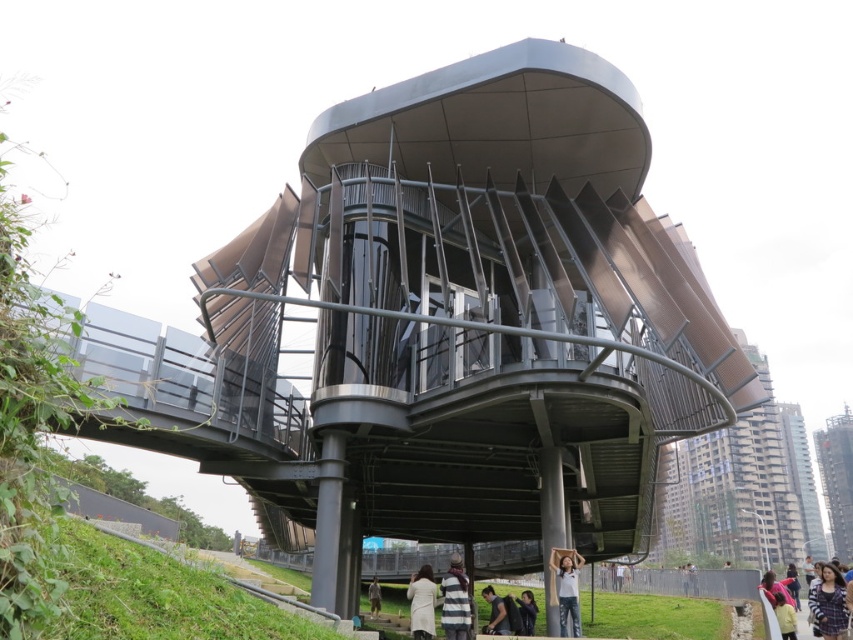
Question: Is beige fabric coat at lower center in front of light brown leather jacket at lower center?

Choices:
 (A) yes
 (B) no

Answer: (A)

Question: Which point is closer to the camera?

Choices:
 (A) (827, 570)
 (B) (374, 602)
 (C) (531, 609)
 (D) (426, 595)

Answer: (D)

Question: Based on their relative distances, which object is farther from the dark brown hair at lower center?

Choices:
 (A) dark brown leather jacket at lower center
 (B) striped wool scarf at lower center

Answer: (B)

Question: Where is metallic brown balcony at right located in relation to plaid shirt at lower right in the image?

Choices:
 (A) above
 (B) below

Answer: (B)

Question: Is metallic brown balcony at right thinner than dark brown leather jacket at lower center?

Choices:
 (A) yes
 (B) no

Answer: (B)

Question: Which object appears closest to the camera in this image?

Choices:
 (A) metallic brown balcony at right
 (B) dark brown leather jacket at lower center

Answer: (A)